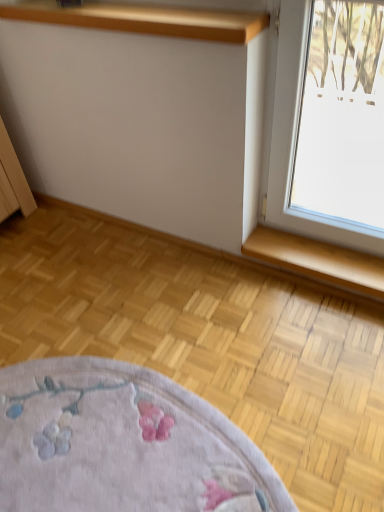
Locate an element on the screen. The width and height of the screenshot is (384, 512). vacant point above wooden shelf at upper center (from a real-world perspective) is located at coordinates (127, 9).